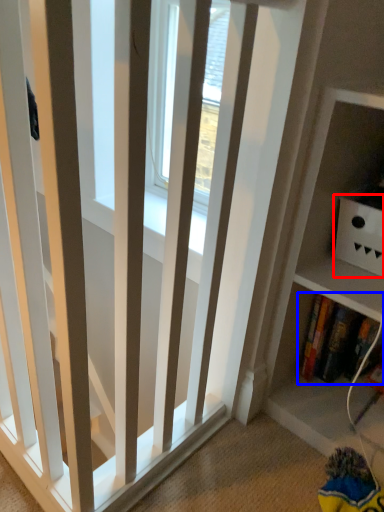
Question: Which object appears closest to the camera in this image, cabinet (highlighted by a red box) or book (highlighted by a blue box)?

Choices:
 (A) cabinet
 (B) book

Answer: (A)